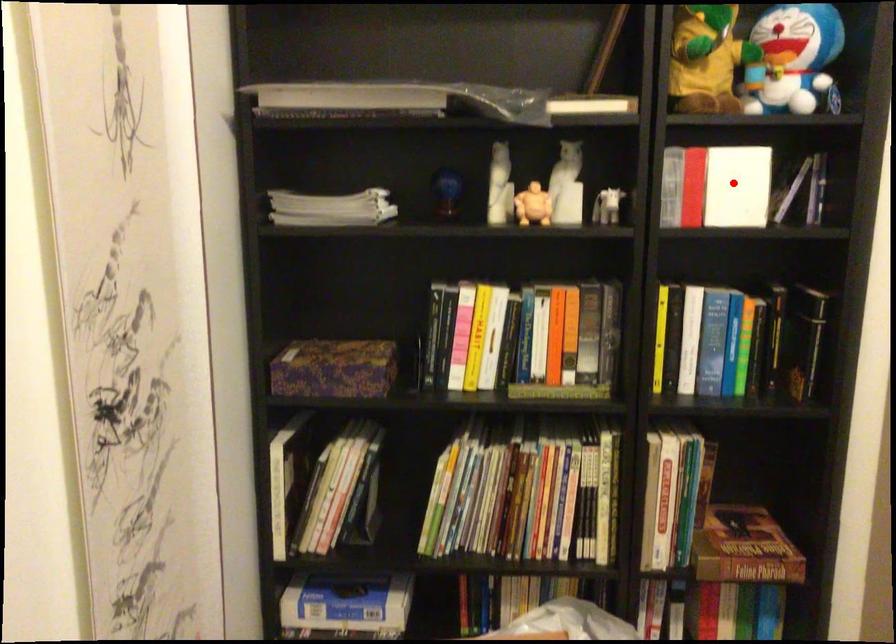
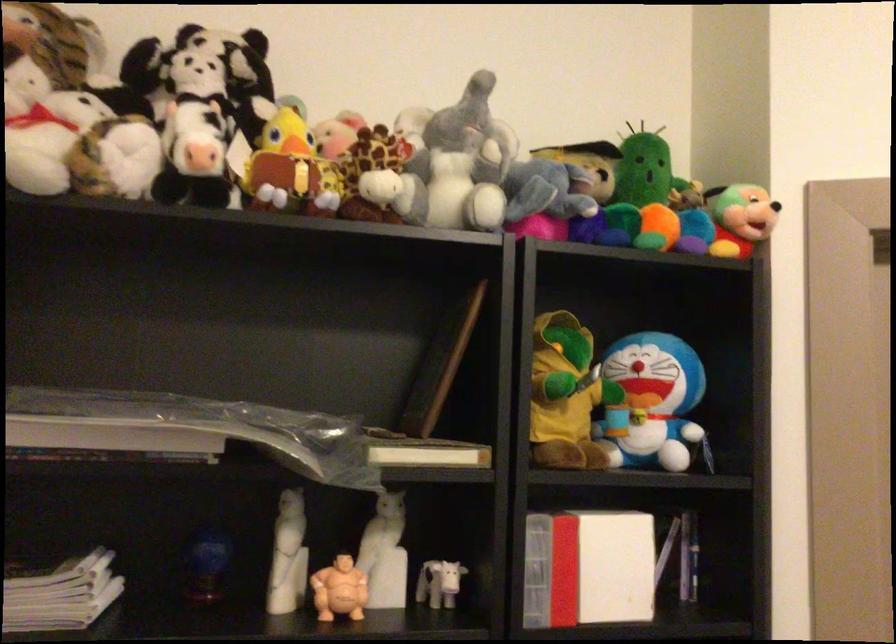
Question: I am providing you with two images of the same scene from different viewpoints. Given a red point in image1, look at the same physical point in image2. Is it:

Choices:
 (A) Closer to the viewpoint
 (B) Farther from the viewpoint

Answer: (A)